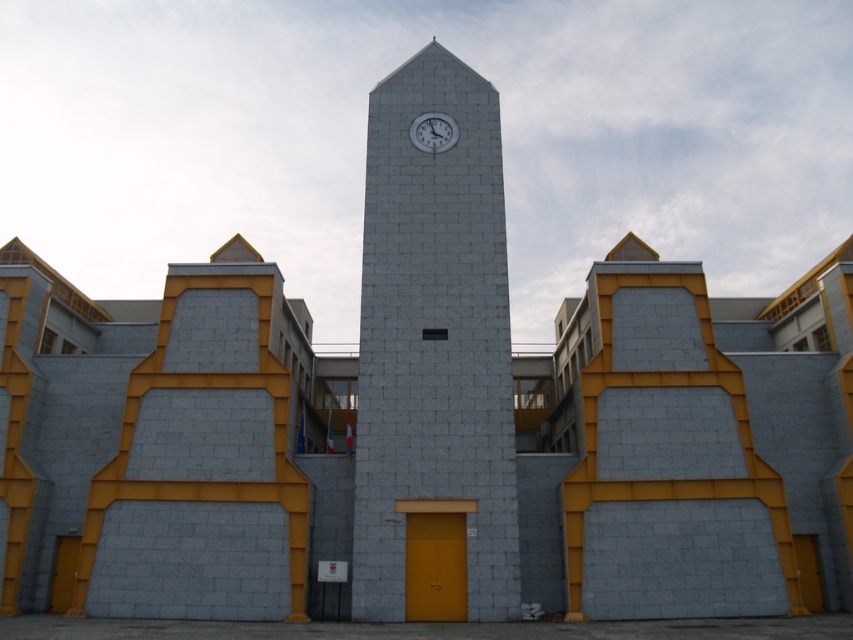
You are standing in front of the building and notice the gray stone clock tower at center and the white glossy clock at upper center. Which object is positioned to the left of the other?

The gray stone clock tower at center is positioned to the left of the white glossy clock at upper center.